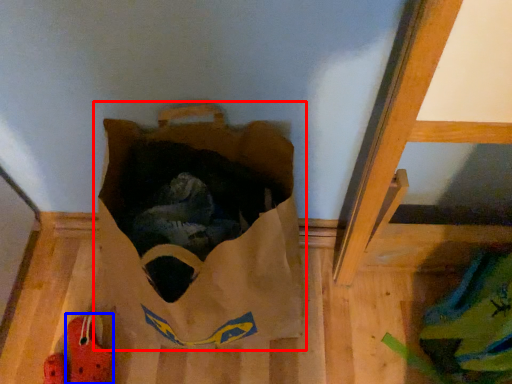
Question: Which of the following is the farthest to the observer, grocery bag (highlighted by a red box) or footwear (highlighted by a blue box)?

Choices:
 (A) grocery bag
 (B) footwear

Answer: (B)